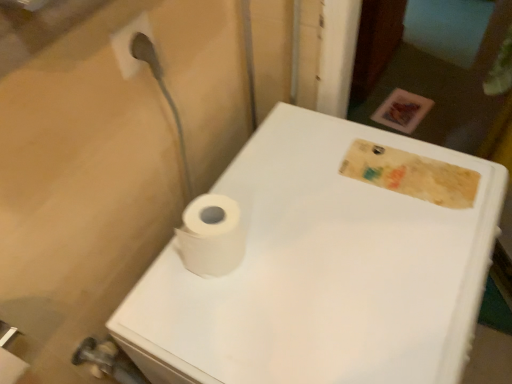
You are a GUI agent. You are given a task and a screenshot of the screen. Output one action in this format:
    pyautogui.click(x=<x>, y=<y>)
    Task: Click on the white matte porcelain at center
    The height and width of the screenshot is (384, 512).
    Given the screenshot: What is the action you would take?
    pyautogui.click(x=321, y=271)

What do you see at coordinates (321, 271) in the screenshot?
I see `white matte porcelain at center` at bounding box center [321, 271].

The width and height of the screenshot is (512, 384). Find the location of `white matte toilet paper at center`. white matte toilet paper at center is located at coordinates (211, 236).

What do you see at coordinates (211, 236) in the screenshot? This screenshot has height=384, width=512. I see `white matte toilet paper at center` at bounding box center [211, 236].

Where is `white matte porcelain at center`? The height and width of the screenshot is (384, 512). white matte porcelain at center is located at coordinates (321, 271).

Can you confirm if white matte toilet paper at center is positioned to the left of white matte porcelain at center?

Yes, white matte toilet paper at center is to the left of white matte porcelain at center.

Is the depth of white matte toilet paper at center greater than that of white matte porcelain at center?

Yes, the depth of white matte toilet paper at center is greater than that of white matte porcelain at center.

Considering the points (193, 272) and (368, 353), which point is in front, point (193, 272) or point (368, 353)?

The point (368, 353) is closer.

From the image's perspective, is white matte toilet paper at center below white matte porcelain at center?

Incorrect, from the image's perspective, white matte toilet paper at center is higher than white matte porcelain at center.

From a real-world perspective, is white matte toilet paper at center above or below white matte porcelain at center?

white matte toilet paper at center is situated higher than white matte porcelain at center in the real world.

Is white matte toilet paper at center thinner than white matte porcelain at center?

Indeed, white matte toilet paper at center has a lesser width compared to white matte porcelain at center.

Can you confirm if white matte toilet paper at center is shorter than white matte porcelain at center?

Yes, white matte toilet paper at center is shorter than white matte porcelain at center.

Does white matte toilet paper at center have a larger size compared to white matte porcelain at center?

No, white matte toilet paper at center is not bigger than white matte porcelain at center.

Could white matte porcelain at center be considered to be inside white matte toilet paper at center?

No, white matte porcelain at center is not a part of white matte toilet paper at center.

Is white matte toilet paper at center beside white matte porcelain at center?

No, white matte toilet paper at center is not beside white matte porcelain at center.

Is white matte porcelain at center at the back of white matte toilet paper at center?

No, white matte toilet paper at center is not facing the opposite direction of white matte porcelain at center.

What's the angular difference between white matte toilet paper at center and white matte porcelain at center's facing directions?

The angular difference between white matte toilet paper at center and white matte porcelain at center is 3.11 degrees.

Measure the distance from white matte toilet paper at center to white matte porcelain at center.

white matte toilet paper at center and white matte porcelain at center are 7.58 inches apart.

This screenshot has width=512, height=384. Find the location of `toilet paper above the white matte porcelain at center (from a real-world perspective)`. toilet paper above the white matte porcelain at center (from a real-world perspective) is located at coordinates (211, 236).

Considering the relative positions of white matte porcelain at center and white matte toilet paper at center in the image provided, is white matte porcelain at center to the right of white matte toilet paper at center from the viewer's perspective?

Yes.

Which object is closer to the camera, white matte porcelain at center or white matte toilet paper at center?

white matte porcelain at center is closer to the camera.

Does point (237, 156) lie behind point (234, 205)?

Yes, point (237, 156) is behind point (234, 205).

From the image's perspective, which is below, white matte porcelain at center or white matte toilet paper at center?

white matte porcelain at center is shown below in the image.

From a real-world perspective, is white matte porcelain at center physically located above or below white matte toilet paper at center?

Clearly, from a real-world perspective, white matte porcelain at center is below white matte toilet paper at center.

Which of these two, white matte porcelain at center or white matte toilet paper at center, is thinner?

white matte toilet paper at center is thinner.

Does white matte porcelain at center have a lesser height compared to white matte toilet paper at center?

No, white matte porcelain at center is not shorter than white matte toilet paper at center.

Is white matte porcelain at center bigger than white matte toilet paper at center?

Indeed, white matte porcelain at center has a larger size compared to white matte toilet paper at center.

Is white matte porcelain at center completely or partially outside of white matte toilet paper at center?

Indeed, white matte porcelain at center is completely outside white matte toilet paper at center.

Is white matte porcelain at center far from white matte toilet paper at center?

Actually, white matte porcelain at center and white matte toilet paper at center are a little close together.

Does white matte porcelain at center turn towards white matte toilet paper at center?

No, white matte porcelain at center does not turn towards white matte toilet paper at center.

How many degrees apart are the facing directions of white matte porcelain at center and white matte toilet paper at center?

The facing directions of white matte porcelain at center and white matte toilet paper at center are 3.11 degrees apart.

Identify the location of toilet paper above the white matte porcelain at center (from the image's perspective). This screenshot has width=512, height=384. (211, 236).

There is a white matte porcelain at center. At what (x,y) coordinates should I click in order to perform the action: click on toilet paper above it (from a real-world perspective). Please return your answer as a coordinate pair (x, y). Image resolution: width=512 pixels, height=384 pixels. Looking at the image, I should click on (211, 236).

This screenshot has height=384, width=512. In order to click on porcelain in front of the white matte toilet paper at center in this screenshot , I will do `click(321, 271)`.